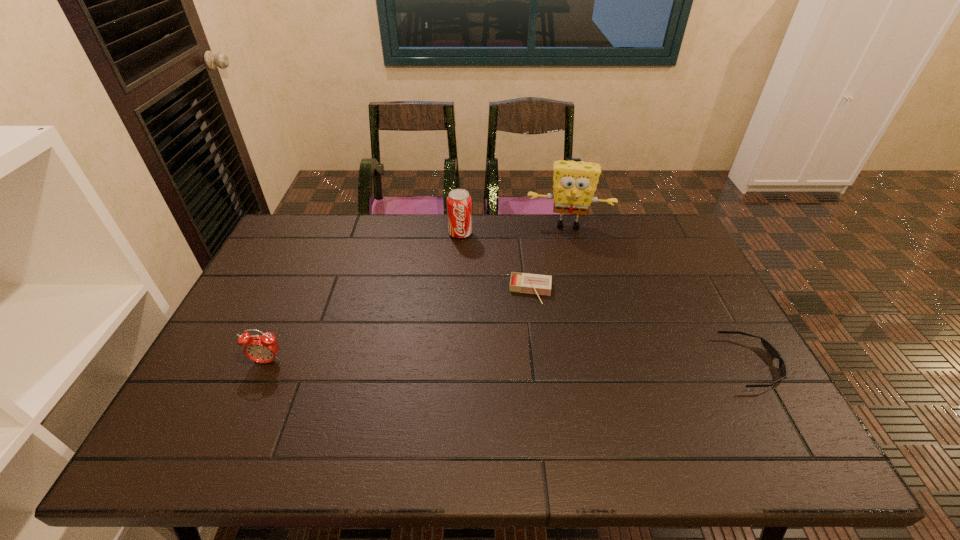
This screenshot has width=960, height=540. In order to click on the third shortest object in this screenshot , I will do `click(263, 348)`.

Where is `alarm clock`? This screenshot has width=960, height=540. alarm clock is located at coordinates (263, 348).

This screenshot has width=960, height=540. In order to click on the shortest object in this screenshot , I will do `click(772, 351)`.

Locate an element on the screen. The height and width of the screenshot is (540, 960). the rightmost object is located at coordinates (772, 351).

The width and height of the screenshot is (960, 540). Identify the location of the second object from left to right. (459, 203).

At what (x,y) coordinates should I click in order to perform the action: click on soda can. Please return your answer as a coordinate pair (x, y). The width and height of the screenshot is (960, 540). Looking at the image, I should click on (x=459, y=203).

Identify the location of the tallest object. The width and height of the screenshot is (960, 540). (574, 185).

Locate an element on the screen. This screenshot has height=540, width=960. matchbox is located at coordinates (537, 284).

I want to click on the second shortest object, so click(537, 284).

The width and height of the screenshot is (960, 540). I want to click on vacant space located 0.090m on the face of the leftmost object, so click(252, 398).